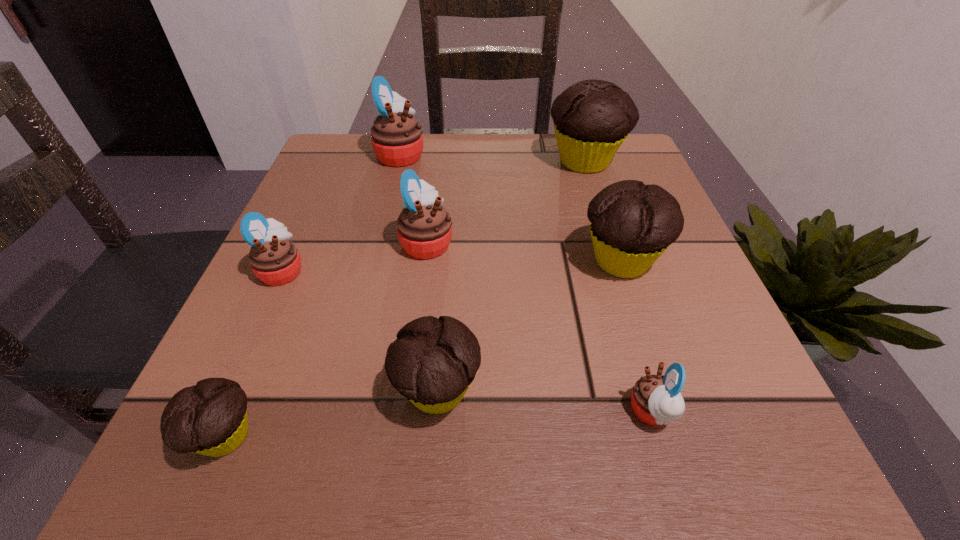
Find the location of a particular element. The width and height of the screenshot is (960, 540). object that is at the near left corner is located at coordinates (210, 418).

I want to click on object that is at the far right corner, so click(x=592, y=118).

Find the location of `object situated at the near right corner`. object situated at the near right corner is located at coordinates (656, 400).

Identify the location of free spot at the far edge of the desktop. (497, 161).

Identify the location of vacant point at the near edge. The image size is (960, 540). (582, 432).

Find the location of a particular element. This screenshot has height=540, width=960. vacant space at the left edge of the desktop is located at coordinates (342, 208).

The width and height of the screenshot is (960, 540). Identify the location of vacant region at the right edge. [x=693, y=339].

Find the location of a particular element. The image size is (960, 540). free point at the far left corner is located at coordinates (328, 157).

Where is `free region at the near left corner of the desktop`? The width and height of the screenshot is (960, 540). free region at the near left corner of the desktop is located at coordinates (272, 464).

Find the location of a particular element. Image resolution: width=960 pixels, height=540 pixels. blank space at the near right corner is located at coordinates click(x=686, y=456).